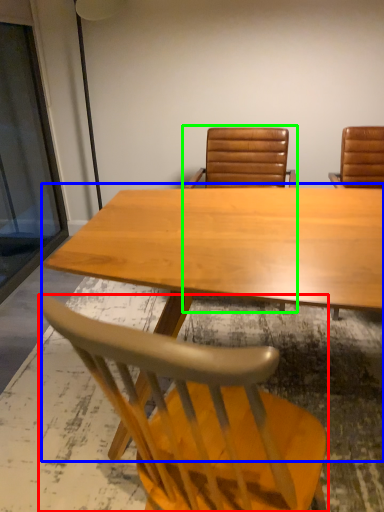
Question: Which object is the closest to the chair (highlighted by a red box)? Choose among these: table (highlighted by a blue box) or chair (highlighted by a green box).

Choices:
 (A) table
 (B) chair

Answer: (A)